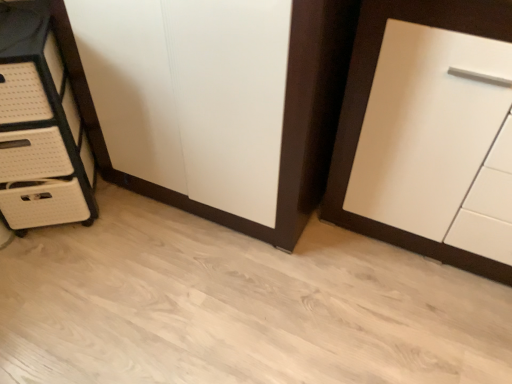
Question: Considering their positions, is white woven chest of drawers at left located in front of or behind white matte cupboard at right?

Choices:
 (A) front
 (B) behind

Answer: (B)

Question: From their relative heights in the image, would you say white woven chest of drawers at left is taller or shorter than white matte cupboard at right?

Choices:
 (A) tall
 (B) short

Answer: (B)

Question: Would you say white woven chest of drawers at left is to the left or to the right of white matte cupboard at right in the picture?

Choices:
 (A) right
 (B) left

Answer: (B)

Question: Is white matte cupboard at right bigger or smaller than white woven chest of drawers at left?

Choices:
 (A) small
 (B) big

Answer: (B)

Question: Considering their positions, is white matte cupboard at right located in front of or behind white woven chest of drawers at left?

Choices:
 (A) behind
 (B) front

Answer: (B)

Question: In terms of width, does white matte cupboard at right look wider or thinner when compared to white woven chest of drawers at left?

Choices:
 (A) thin
 (B) wide

Answer: (B)

Question: Would you say white matte cupboard at right is to the left or to the right of white woven chest of drawers at left in the picture?

Choices:
 (A) left
 (B) right

Answer: (B)